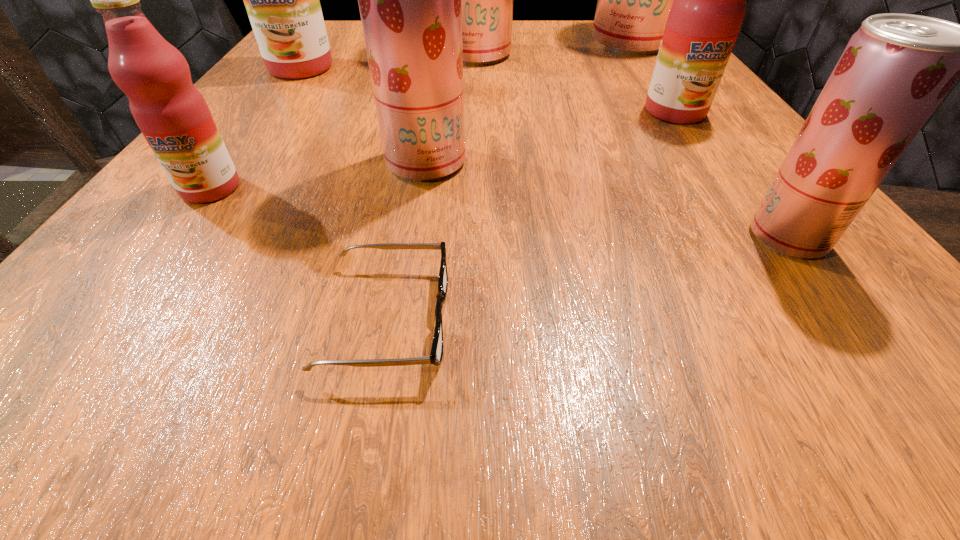
At what (x,y) coordinates should I click in order to perform the action: click on the third closest pink fruit juice to the nearest strawberry fruit juice. Please return your answer as a coordinate pair (x, y). The height and width of the screenshot is (540, 960). Looking at the image, I should click on (282, 0).

The image size is (960, 540). Find the location of `pink fruit juice that is the second closest to the third smallest strawberry fruit juice`. pink fruit juice that is the second closest to the third smallest strawberry fruit juice is located at coordinates pyautogui.click(x=709, y=6).

Image resolution: width=960 pixels, height=540 pixels. Find the location of `free space that satisfies the following two spatial constraints: 1. on the back side of the third biggest strawberry fruit juice; 2. on the right side of the tallest object`. free space that satisfies the following two spatial constraints: 1. on the back side of the third biggest strawberry fruit juice; 2. on the right side of the tallest object is located at coordinates (444, 43).

Locate an element on the screen. This screenshot has width=960, height=540. vacant space that satisfies the following two spatial constraints: 1. on the label of the farthest pink fruit juice; 2. on the left side of the third farthest strawberry fruit juice is located at coordinates (233, 162).

Where is `blank area in the image that satisfies the following two spatial constraints: 1. on the label of the smallest strawberry fruit juice; 2. on the left side of the nearest pink fruit juice`? The image size is (960, 540). blank area in the image that satisfies the following two spatial constraints: 1. on the label of the smallest strawberry fruit juice; 2. on the left side of the nearest pink fruit juice is located at coordinates (175, 237).

I want to click on blank space that satisfies the following two spatial constraints: 1. on the label of the nearest pink fruit juice; 2. on the left side of the smallest strawberry fruit juice, so click(x=175, y=237).

This screenshot has width=960, height=540. I want to click on vacant space that satisfies the following two spatial constraints: 1. on the back side of the tallest object; 2. on the right side of the second smallest strawberry fruit juice, so click(x=444, y=43).